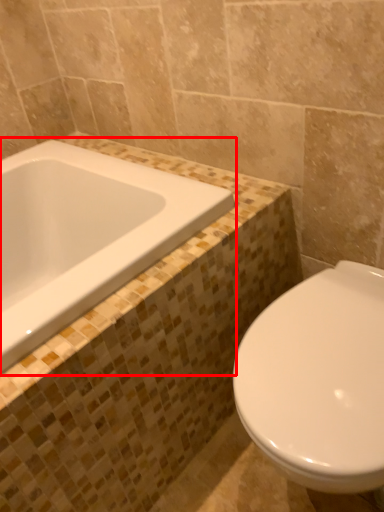
Question: From the image's perspective, what is the correct spatial positioning of bathtub (annotated by the red box) in reference to toilet?

Choices:
 (A) below
 (B) above

Answer: (B)